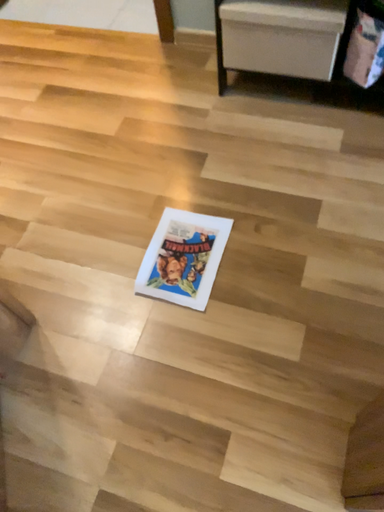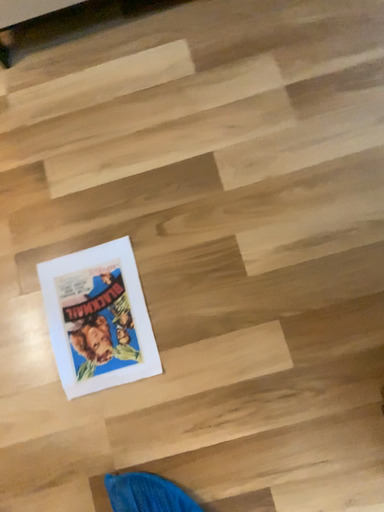
Question: How did the camera likely rotate when shooting the video?

Choices:
 (A) rotated left
 (B) rotated right

Answer: (B)